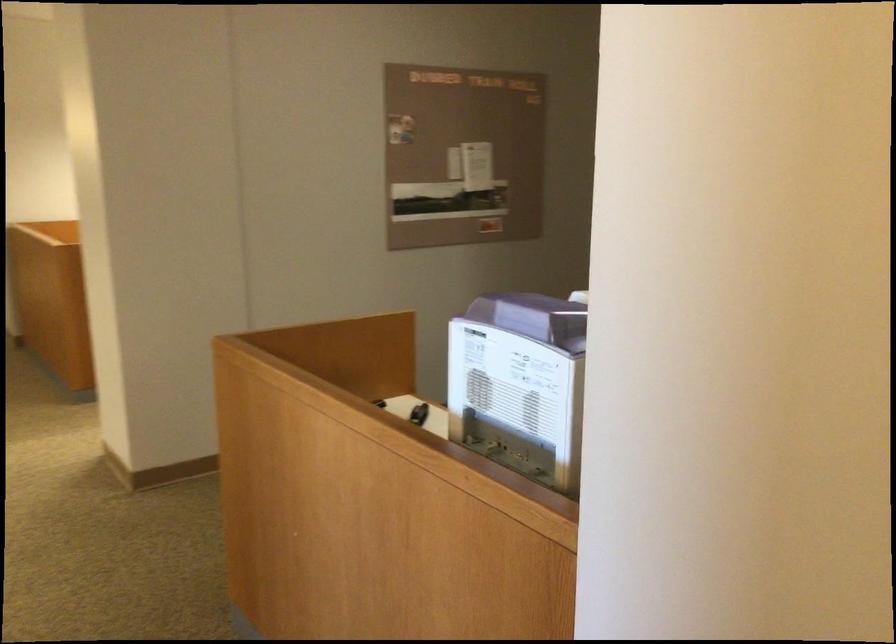
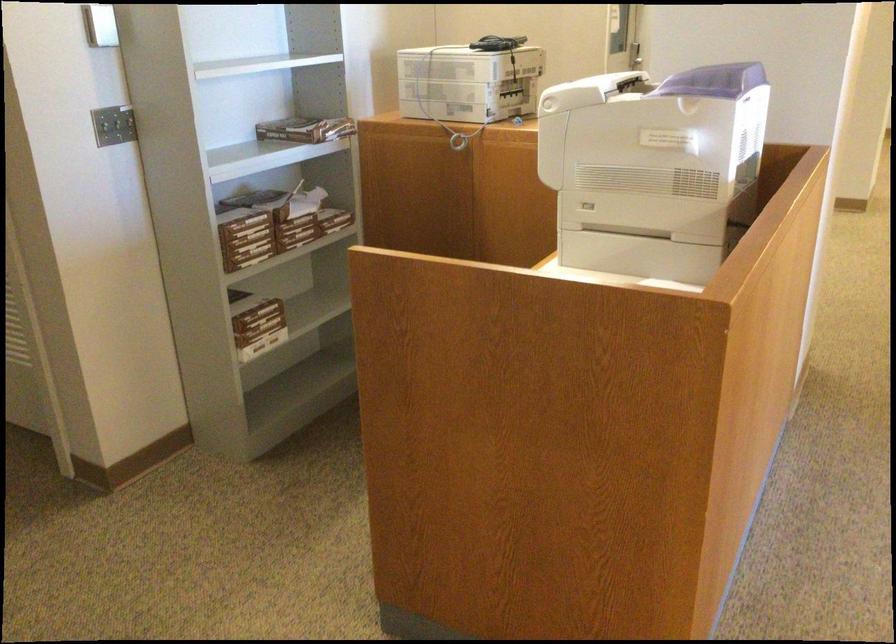
Question: I am providing you with two images of the same scene from different viewpoints. Please identify which objects are invisible in image2.

Choices:
 (A) light switch
 (B) black handheld device
 (C) small black object
 (D) yellow pendant controller

Answer: (C)